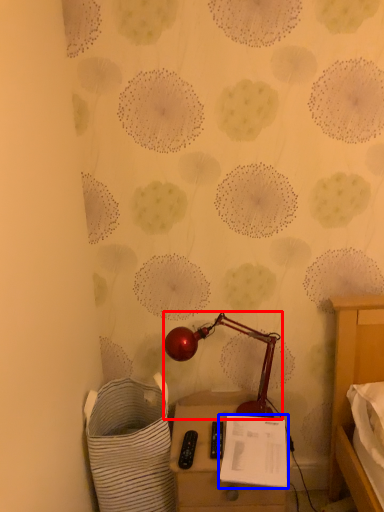
Question: Which object is further to the camera taking this photo, lamp (highlighted by a red box) or notepad (highlighted by a blue box)?

Choices:
 (A) lamp
 (B) notepad

Answer: (A)